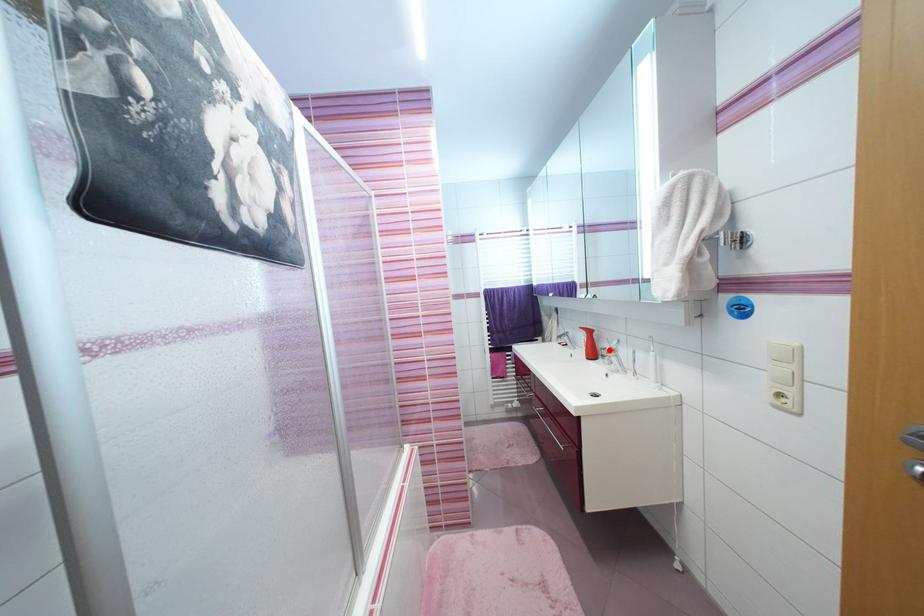
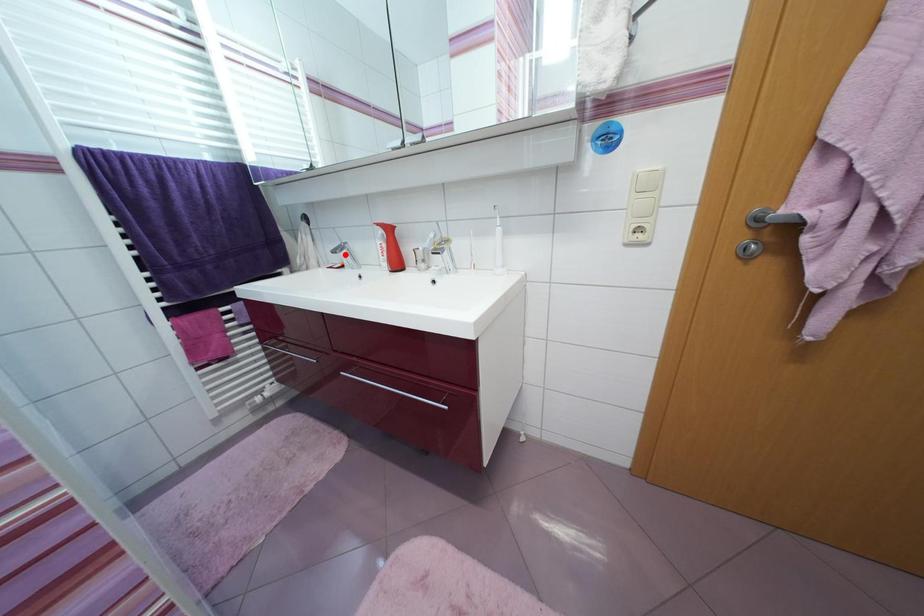
I am providing you with two images of the same scene from different viewpoints. A red point is marked on the first image and another point is marked on the second image. Is the marked point in image1 the same physical position as the marked point in image2?

No